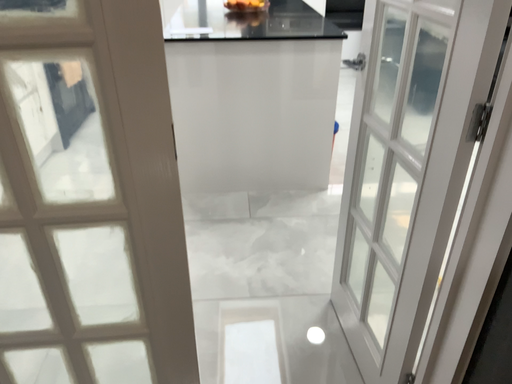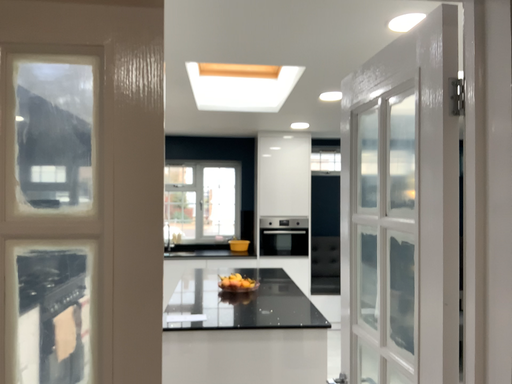
Question: Which way did the camera rotate in the video?

Choices:
 (A) rotated downward
 (B) rotated upward

Answer: (B)